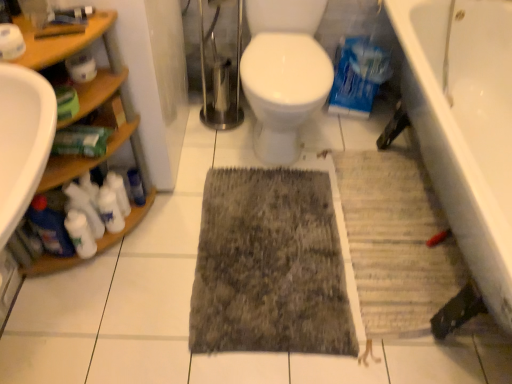
Question: Considering the positions of point (73, 64) and point (38, 226), is point (73, 64) closer or farther from the camera than point (38, 226)?

Choices:
 (A) closer
 (B) farther

Answer: (A)

Question: Is white matte toilet paper at upper left, marked as the 1th toilet paper in a right-to-left arrangement, inside the boundaries of blue glossy bottle at left, the 4th cleaning product viewed from the right, or outside?

Choices:
 (A) inside
 (B) outside

Answer: (B)

Question: Which object is the farthest from the white ceramic bathtub at lower right?

Choices:
 (A) gray textured bath mat at lower right
 (B) white matte toilet paper at upper left, the first toilet paper viewed from the back
 (C) blue plastic bottle at left
 (D) white matte cleaning product at lower left, acting as the 2th cleaning product starting from the left
 (E) dark gray textured rug at center

Answer: (D)

Question: Estimate the real-world distances between objects in this image. Which object is farther from the woodenshelves at left?

Choices:
 (A) white matte cleaning products at lower left, which is counted as the 3th cleaning product, starting from the left
 (B) white ceramic bathtub at lower right
 (C) blue plastic bottle at left
 (D) white matte toilet paper at upper left, acting as the 2th toilet paper starting from the back
 (E) white matte cleaning product at left, placed as the 4th cleaning product when sorted from left to right

Answer: (B)